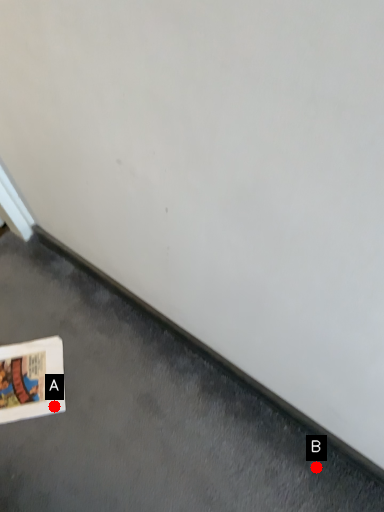
Question: Two points are circled on the image, labeled by A and B beside each circle. Which point is further to the camera?

Choices:
 (A) A is further
 (B) B is further

Answer: (A)